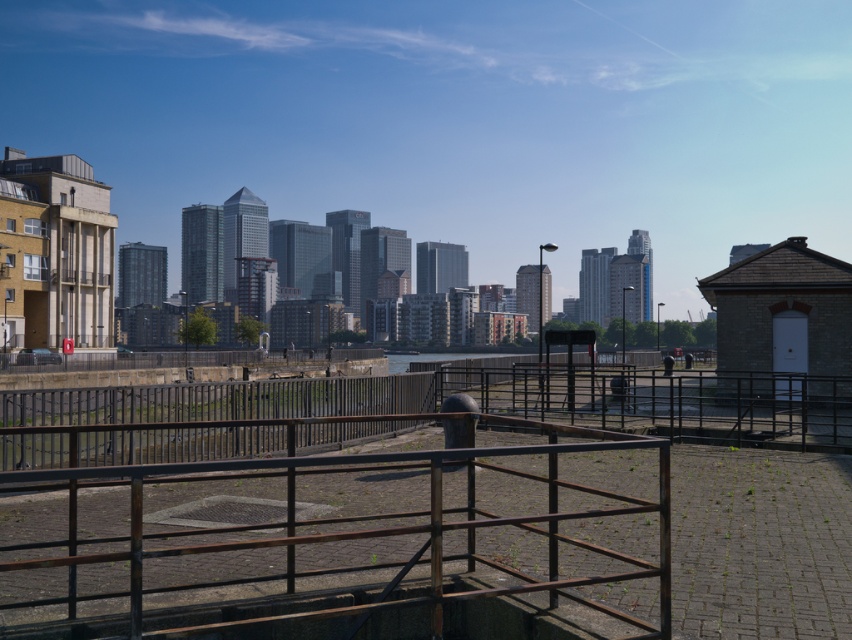
Can you confirm if rusty metal rail at center is positioned above rusty metal fence at center?

Yes.

Is point (494, 566) closer to camera compared to point (67, 403)?

Yes, it is.

You are a GUI agent. You are given a task and a screenshot of the screen. Output one action in this format:
    pyautogui.click(x=<x>, y=<y>)
    Task: Click on the rusty metal rail at center
    
    Given the screenshot: What is the action you would take?
    pyautogui.click(x=329, y=536)